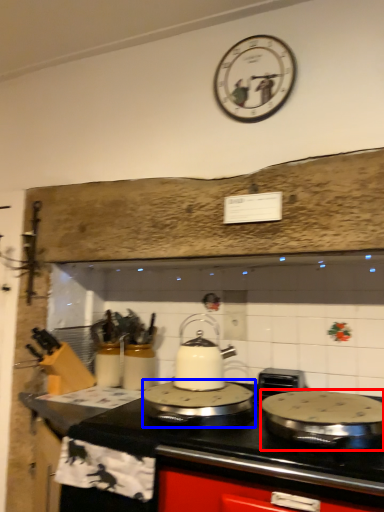
Question: Which object is further to the camera taking this photo, kitchen appliance (highlighted by a red box) or kitchen appliance (highlighted by a blue box)?

Choices:
 (A) kitchen appliance
 (B) kitchen appliance

Answer: (B)